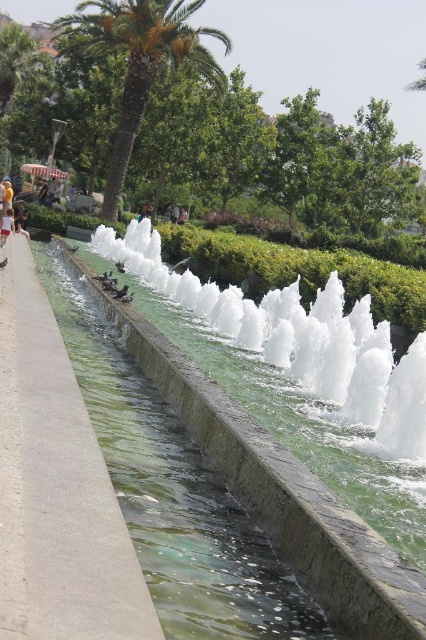
You are a photographer standing at the edge of the water feature and want to take a photo of the gray concrete pavement at center and the white cotton shirt at center. Which object appears taller in the photo?

The gray concrete pavement at center appears taller than the white cotton shirt at center in the photo because the description states that it is much taller.

You are standing at the point labeled as point (279, 490) in the image. What is the object directly beneath your feet?

The point (279, 490) indicates clear glass water at center, so the object directly beneath your feet is clear glass water at center.